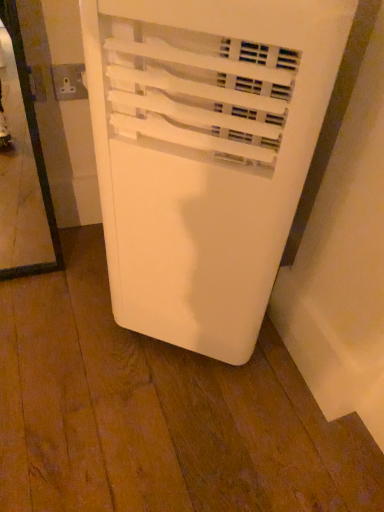
Question: From the image's perspective, is white plastic socket at upper left positioned above or below white plastic air conditioner at center?

Choices:
 (A) above
 (B) below

Answer: (A)

Question: Considering the positions of white plastic socket at upper left and white plastic air conditioner at center in the image, is white plastic socket at upper left wider or thinner than white plastic air conditioner at center?

Choices:
 (A) wide
 (B) thin

Answer: (B)

Question: Visually, is white plastic socket at upper left positioned to the left or to the right of white plastic air conditioner at center?

Choices:
 (A) left
 (B) right

Answer: (A)

Question: Which is correct: white plastic air conditioner at center is inside white plastic socket at upper left, or outside of it?

Choices:
 (A) inside
 (B) outside

Answer: (B)

Question: From the image's perspective, is white plastic air conditioner at center located above or below white plastic socket at upper left?

Choices:
 (A) above
 (B) below

Answer: (B)

Question: Based on their positions, is white plastic air conditioner at center located to the left or right of white plastic socket at upper left?

Choices:
 (A) right
 (B) left

Answer: (A)

Question: In terms of width, does white plastic air conditioner at center look wider or thinner when compared to white plastic socket at upper left?

Choices:
 (A) wide
 (B) thin

Answer: (A)